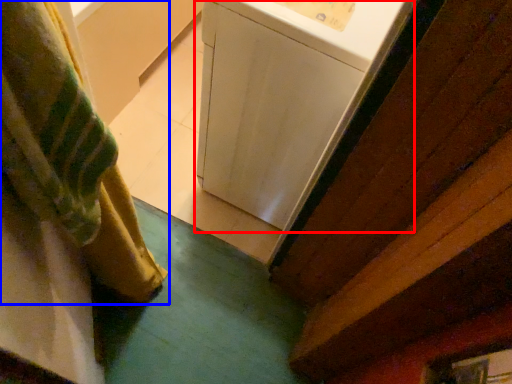
Question: Which object is further to the camera taking this photo, washing machine (highlighted by a red box) or curtain (highlighted by a blue box)?

Choices:
 (A) washing machine
 (B) curtain

Answer: (A)